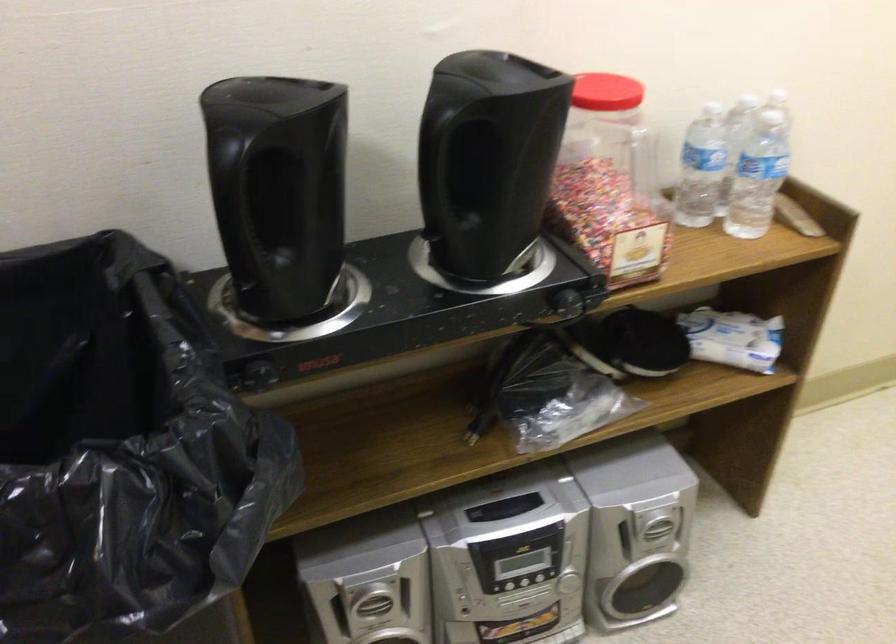
Where is `silver stereo dial`? This screenshot has width=896, height=644. silver stereo dial is located at coordinates (522, 564).